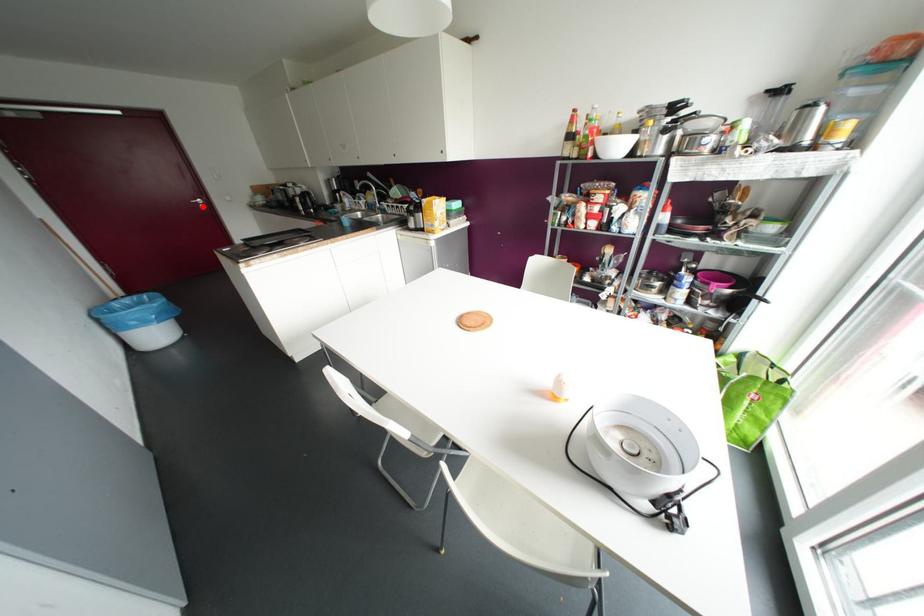
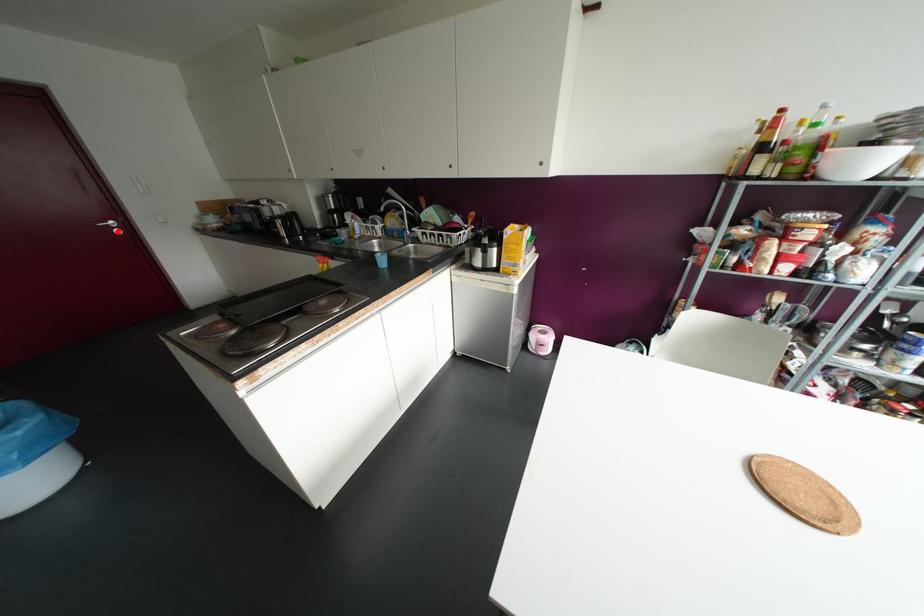
I am providing you with two images of the same scene from different viewpoints. A red point is marked on the first image and another point is marked on the second image. Does the point marked in image1 correspond to the same location as the one in image2?

Yes